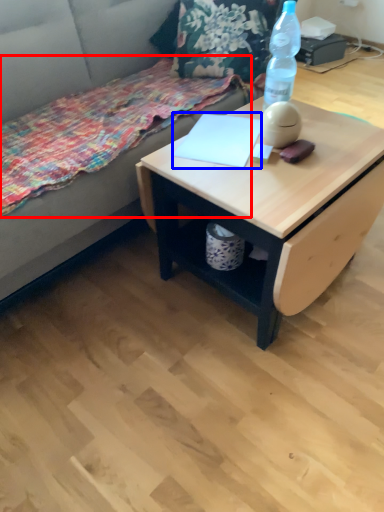
Question: Which of the following is the farthest to the observer, blanket (highlighted by a red box) or notepad (highlighted by a blue box)?

Choices:
 (A) blanket
 (B) notepad

Answer: (B)